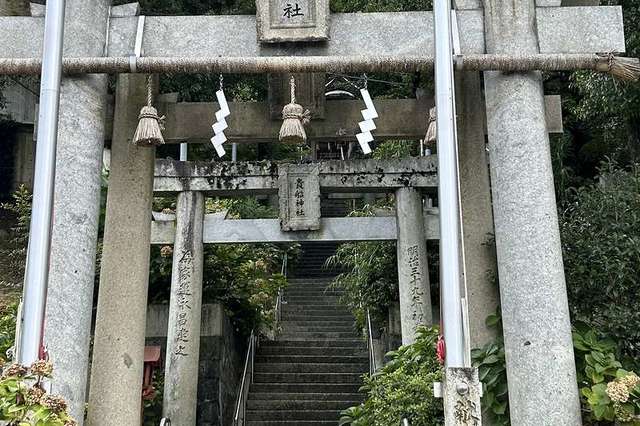
You are a GUI agent. You are given a task and a screenshot of the screen. Output one action in this format:
    pyautogui.click(x=<x>, y=<y>)
    Task: Click on the rightmost pillar
    
    Given the screenshot: What is the action you would take?
    pyautogui.click(x=543, y=256)